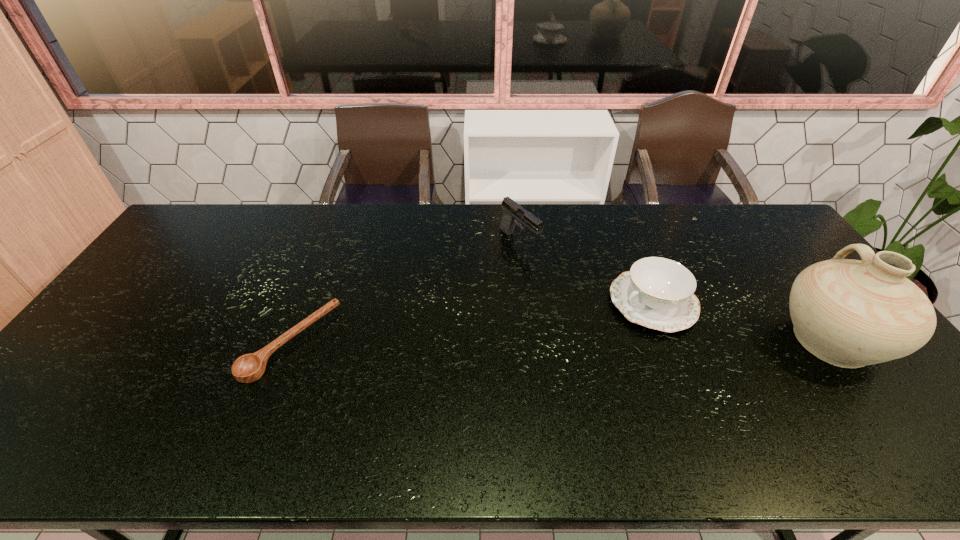
In order to click on vacant space that satisfies the following two spatial constraints: 1. on the back side of the leftmost object; 2. on the left side of the pistol in this screenshot , I will do coord(331,241).

The image size is (960, 540). What are the coordinates of `vacant space that satisfies the following two spatial constraints: 1. on the back side of the leftmost object; 2. on the right side of the pistol` in the screenshot? It's located at (331, 241).